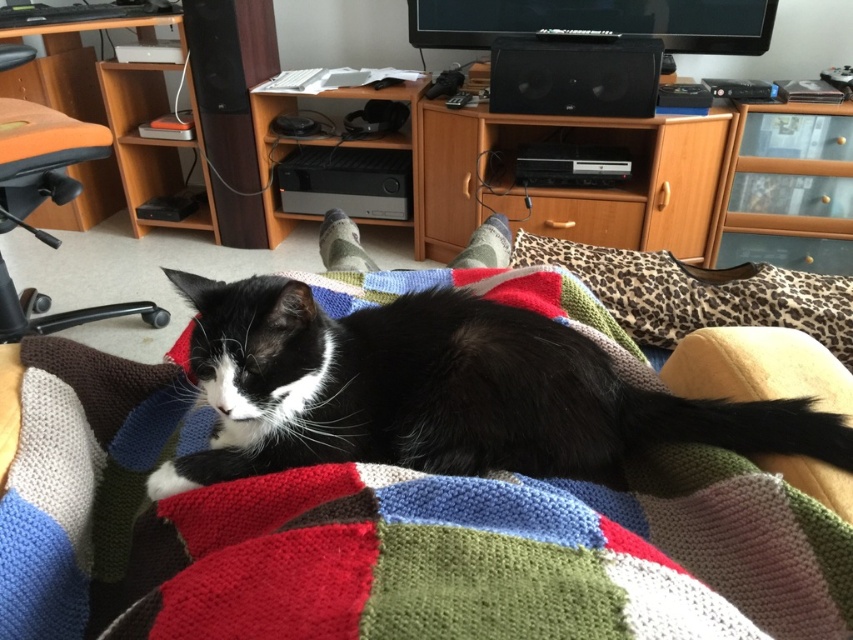
You are sitting on the orange fabric computer chair at left and want to reach the leopard print fabric pillow at lower right. Is the pillow located underneath the chair or behind it?

The leopard print fabric pillow at lower right is positioned under orange fabric computer chair at left, so the pillow is located underneath the chair.

You are organizing a space for a cat and need to place a cat bed. The cat bed must be placed in a spot where the black soft fur cat at center can easily access it without moving past the orange wood computer desk at left. Where should you place the cat bed?

The cat bed should be placed near the black soft fur cat at center, in front of the orange wood computer desk at left since the cat is already positioned in front of the desk and doesn

You are standing in front of the image and see two points marked on it. Which point, point (705, 310) or point (86, 316), is closer to you?

Point (705, 310) is closer to the viewer than point (86, 316).